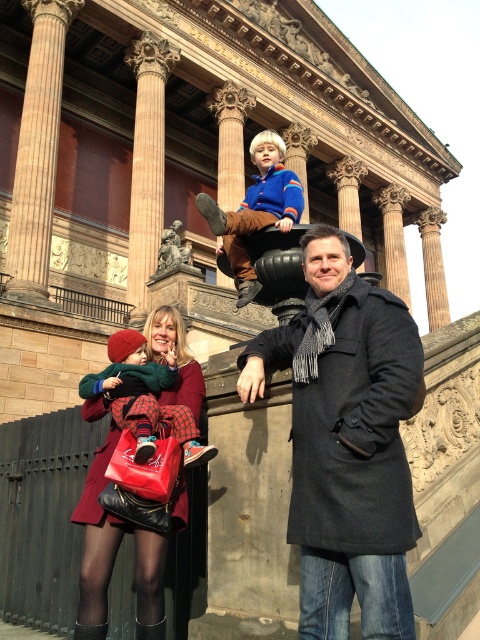
Question: Does matte red coat at center have a greater width compared to smooth stone column at center?

Choices:
 (A) no
 (B) yes

Answer: (B)

Question: Which object is the farthest from the smooth stone column at center?

Choices:
 (A) knitted wool sweater at center
 (B) matte red coat at center
 (C) velvety brown pants at upper center

Answer: (B)

Question: Which object is the farthest from the brown polished stone column at upper center?

Choices:
 (A) dark gray wool coat at center
 (B) knitted wool sweater at center
 (C) matte red coat at center
 (D) smooth stone column at center

Answer: (A)

Question: Is matte red coat at center behind velvety brown pants at upper center?

Choices:
 (A) yes
 (B) no

Answer: (B)

Question: Among these objects, which one is farthest from the camera?

Choices:
 (A) velvety brown pants at upper center
 (B) brown polished stone column at upper center

Answer: (B)

Question: Does brown polished stone column at upper center appear on the left side of knitted wool sweater at center?

Choices:
 (A) no
 (B) yes

Answer: (B)